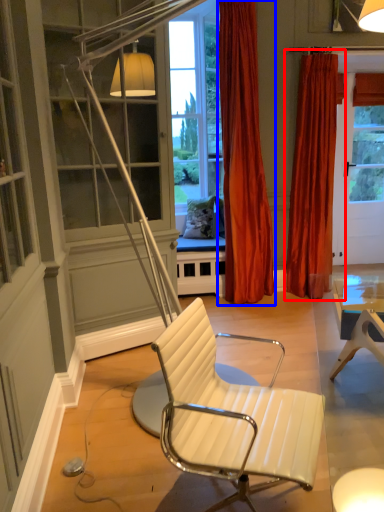
Question: Which object is closer to the camera taking this photo, curtain (highlighted by a red box) or curtain (highlighted by a blue box)?

Choices:
 (A) curtain
 (B) curtain

Answer: (B)